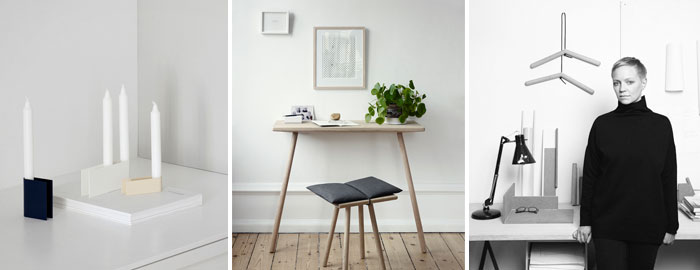
Image resolution: width=700 pixels, height=270 pixels. Find the location of `art`. art is located at coordinates (267, 37), (329, 74), (570, 77).